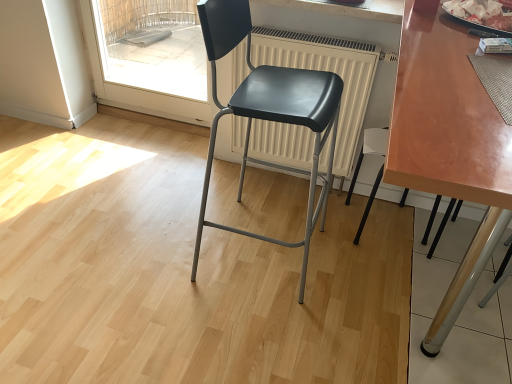
I want to click on white matte radiator at center, so click(329, 71).

You are a GUI agent. You are given a task and a screenshot of the screen. Output one action in this format:
    pyautogui.click(x=<x>, y=<y>)
    Task: Click on the matte black chair at lower right, marked as the 1th chair in a right-to-left arrangement
    
    Given the screenshot: What is the action you would take?
    pyautogui.click(x=369, y=151)

Image resolution: width=512 pixels, height=384 pixels. Describe the element at coordinates (369, 151) in the screenshot. I see `matte black chair at lower right, marked as the 1th chair in a right-to-left arrangement` at that location.

Find the location of a particular element. The height and width of the screenshot is (384, 512). white matte radiator at center is located at coordinates (329, 71).

Based on their positions, is white matte radiator at center located to the left or right of shiny brown table at center?

From the image, it's evident that white matte radiator at center is to the left of shiny brown table at center.

From the picture: Does white matte radiator at center contain shiny brown table at center?

No, shiny brown table at center is not a part of white matte radiator at center.

Which of these two, white matte radiator at center or shiny brown table at center, is bigger?

shiny brown table at center is bigger.

Which point is more forward, [295,51] or [488,216]?

The point [295,51] is in front.

From a real-world perspective, between matte black chair at lower right, marked as the 1th chair in a right-to-left arrangement, and shiny brown table at center, who is vertically higher?

shiny brown table at center, from a real-world perspective.

Is matte black chair at lower right, marked as the 1th chair in a right-to-left arrangement, shorter than shiny brown table at center?

Yes.

From the image's perspective, which object appears higher, matte black chair at lower right, which appears as the 2th chair when viewed from the left, or shiny brown table at center?

matte black chair at lower right, which appears as the 2th chair when viewed from the left, appears higher in the image.

Identify the location of chair directly beneath the shiny brown table at center (from a real-world perspective). This screenshot has height=384, width=512. (369, 151).

Which object is closer to the camera, shiny brown table at center or white matte radiator at center?

shiny brown table at center is in front.

Is shiny brown table at center facing towards white matte radiator at center?

No, shiny brown table at center is not oriented towards white matte radiator at center.

Is shiny brown table at center smaller than white matte radiator at center?

No.

What's the angular difference between shiny brown table at center and white matte radiator at center's facing directions?

There is a 0.000253-degree angle between the facing directions of shiny brown table at center and white matte radiator at center.

From the image's perspective, is shiny brown table at center located beneath matte black chair at lower right, marked as the 1th chair in a right-to-left arrangement?

Yes.

Could you tell me if shiny brown table at center is facing matte black chair at lower right, which appears as the 2th chair when viewed from the left?

No, shiny brown table at center is not turned towards matte black chair at lower right, which appears as the 2th chair when viewed from the left.

In terms of size, does shiny brown table at center appear bigger or smaller than matte black chair at lower right, which appears as the 2th chair when viewed from the left?

Considering their sizes, shiny brown table at center takes up more space than matte black chair at lower right, which appears as the 2th chair when viewed from the left.

Is shiny brown table at center inside the boundaries of matte black chair at lower right, marked as the 1th chair in a right-to-left arrangement, or outside?

shiny brown table at center is spatially situated outside matte black chair at lower right, marked as the 1th chair in a right-to-left arrangement.

Would you say shiny silver tray at upper right is inside or outside matte black chair at center, the second chair when ordered from right to left?

shiny silver tray at upper right is outside matte black chair at center, the second chair when ordered from right to left.

Can you confirm if shiny silver tray at upper right is wider than matte black chair at center, the second chair when ordered from right to left?

In fact, shiny silver tray at upper right might be narrower than matte black chair at center, the second chair when ordered from right to left.

You are a GUI agent. You are given a task and a screenshot of the screen. Output one action in this format:
    pyautogui.click(x=<x>, y=<y>)
    Task: Click on the food behind the matte black chair at center, the second chair when ordered from right to left
    Image resolution: width=512 pixels, height=384 pixels.
    Given the screenshot: What is the action you would take?
    pyautogui.click(x=480, y=13)

How many degrees apart are the facing directions of transparent glass door at upper left and matte black chair at lower right, which appears as the 2th chair when viewed from the left?

They differ by 0.000144 degrees in their facing directions.

Who is bigger, transparent glass door at upper left or matte black chair at lower right, marked as the 1th chair in a right-to-left arrangement?

With larger size is transparent glass door at upper left.

From the image's perspective, which is above, transparent glass door at upper left or matte black chair at lower right, marked as the 1th chair in a right-to-left arrangement?

transparent glass door at upper left.

Between point (273, 77) and point (481, 22), which one is positioned behind?

The point (273, 77) is behind.

From the image's perspective, is matte black chair at center, which is the 1th chair in left-to-right order, above shiny silver tray at upper right?

No, from the image's perspective, matte black chair at center, which is the 1th chair in left-to-right order, is not over shiny silver tray at upper right.

Based on the photo, from their relative heights in the image, would you say matte black chair at center, the second chair when ordered from right to left, is taller or shorter than shiny silver tray at upper right?

matte black chair at center, the second chair when ordered from right to left, is taller than shiny silver tray at upper right.

Between matte black chair at center, the second chair when ordered from right to left, and shiny silver tray at upper right, which one has larger width?

matte black chair at center, the second chair when ordered from right to left, is wider.

You are a GUI agent. You are given a task and a screenshot of the screen. Output one action in this format:
    pyautogui.click(x=<x>, y=<y>)
    Task: Click on the radiator below the shiny brown table at center (from a real-world perspective)
    The height and width of the screenshot is (384, 512).
    Given the screenshot: What is the action you would take?
    pyautogui.click(x=329, y=71)

Where is `table on the right side of matte black chair at lower right, marked as the 1th chair in a right-to-left arrangement`? This screenshot has width=512, height=384. table on the right side of matte black chair at lower right, marked as the 1th chair in a right-to-left arrangement is located at coordinates (449, 144).

Consider the image. Considering their positions, is shiny brown table at center positioned further to matte black chair at center, the second chair when ordered from right to left, than shiny silver tray at upper right?

shiny silver tray at upper right.

Considering their positions, is white matte radiator at center positioned further to transparent glass door at upper left than matte black chair at center, the second chair when ordered from right to left?

Based on the image, matte black chair at center, the second chair when ordered from right to left, appears to be further to transparent glass door at upper left.

Which object lies nearer to the anchor point white matte radiator at center, shiny silver tray at upper right or matte black chair at lower right, which appears as the 2th chair when viewed from the left?

matte black chair at lower right, which appears as the 2th chair when viewed from the left.

From the image, which object appears to be farther from shiny brown table at center, matte black chair at lower right, which appears as the 2th chair when viewed from the left, or white matte radiator at center?

matte black chair at lower right, which appears as the 2th chair when viewed from the left.

When comparing their distances from matte black chair at center, which is the 1th chair in left-to-right order, does transparent glass door at upper left or matte black chair at lower right, marked as the 1th chair in a right-to-left arrangement, seem further?

Among the two, transparent glass door at upper left is located further to matte black chair at center, which is the 1th chair in left-to-right order.

Based on their spatial positions, is matte black chair at center, which is the 1th chair in left-to-right order, or shiny silver tray at upper right closer to white matte radiator at center?

The object closer to white matte radiator at center is matte black chair at center, which is the 1th chair in left-to-right order.

Which object lies further to the anchor point shiny brown table at center, matte black chair at center, the second chair when ordered from right to left, or shiny silver tray at upper right?

matte black chair at center, the second chair when ordered from right to left, is positioned further to the anchor shiny brown table at center.

In the scene shown: Looking at the image, which one is located further to matte black chair at center, which is the 1th chair in left-to-right order, transparent glass door at upper left or shiny silver tray at upper right?

transparent glass door at upper left lies further to matte black chair at center, which is the 1th chair in left-to-right order, than the other object.

At what (x,y) coordinates should I click in order to perform the action: click on chair located between shiny brown table at center and matte black chair at lower right, which appears as the 2th chair when viewed from the left, in the depth direction. Please return your answer as a coordinate pair (x, y). Looking at the image, I should click on (268, 111).

Identify the location of chair located between matte black chair at center, the second chair when ordered from right to left, and white matte radiator at center in the depth direction. Image resolution: width=512 pixels, height=384 pixels. (369, 151).

Find the location of `food located between shiny brown table at center and matte black chair at lower right, marked as the 1th chair in a right-to-left arrangement, in the depth direction`. food located between shiny brown table at center and matte black chair at lower right, marked as the 1th chair in a right-to-left arrangement, in the depth direction is located at coordinates (480, 13).

Locate an element on the screen. chair situated between transparent glass door at upper left and matte black chair at lower right, marked as the 1th chair in a right-to-left arrangement, from left to right is located at coordinates (x=268, y=111).